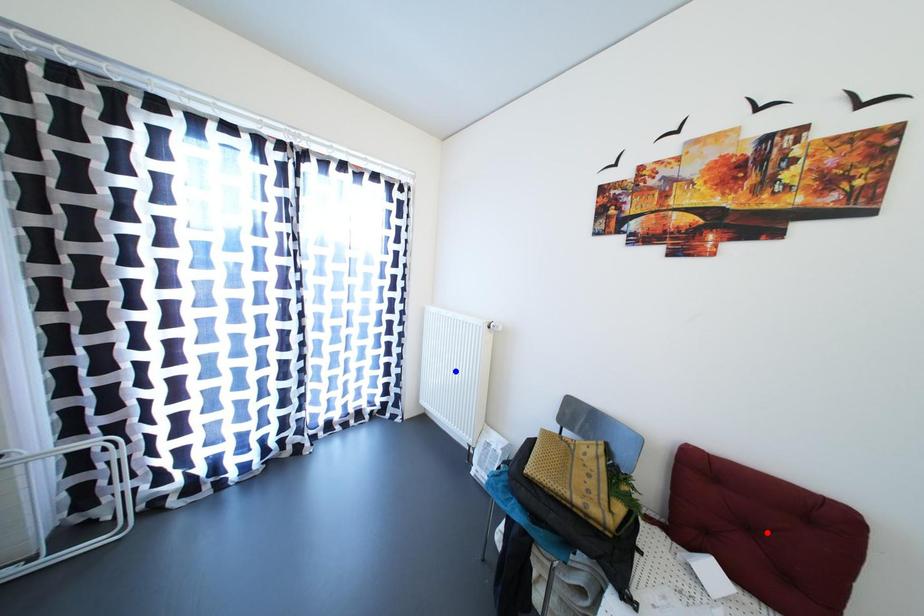
Question: Two points are marked on the image. Which point is closer to the camera?

Choices:
 (A) Blue point is closer.
 (B) Red point is closer.

Answer: (B)